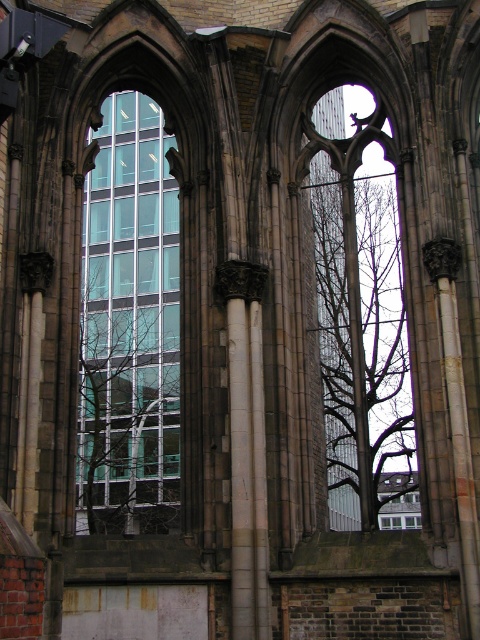
Is bare branches at center positioned in front of white marble pillar at center?

No, it is not.

Is bare branches at center behind white marble pillar at center?

Yes, it is behind white marble pillar at center.

Does point (339, 362) come behind point (242, 326)?

Yes, point (339, 362) is farther from viewer.

Where is `bare branches at center`? bare branches at center is located at coordinates (384, 349).

Is transparent glass building at center above bare branches at center?

Yes.

Does point (130, 202) come closer to viewer compared to point (339, 243)?

No, (130, 202) is further to viewer.

At what (x,y) coordinates should I click in order to perform the action: click on transparent glass building at center. Please return your answer as a coordinate pair (x, y). Image resolution: width=480 pixels, height=640 pixels. Looking at the image, I should click on (130, 326).

Is transparent glass building at center positioned in front of white marble pillar at center?

No, transparent glass building at center is behind white marble pillar at center.

Is point (136, 212) positioned after point (240, 276)?

That is True.

Locate an element on the screen. Image resolution: width=480 pixels, height=640 pixels. transparent glass building at center is located at coordinates (130, 326).